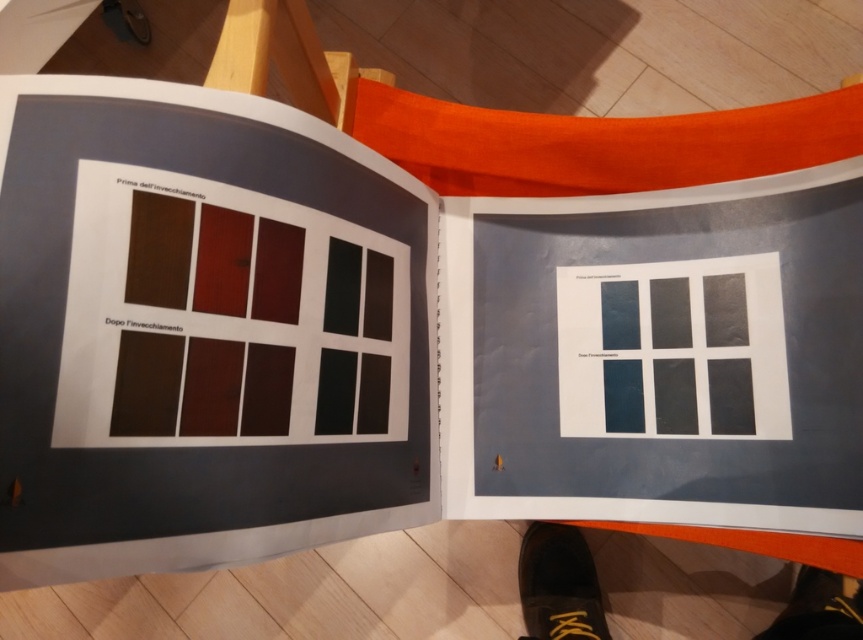
You are holding a measuring tool and need to determine if a specific point in the image is within a safe distance for a robotic arm to reach. The robotic arm has a maximum reach of 36 inches. Is the point at coordinates point (x=861, y=593) within the robotic arm reach?

The distance of point (x=861, y=593) from camera is 35.03 inches, so yes, the robotic arm can reach it since its maximum reach is 36 inches, which is longer than the distance of 35.03 inches.

Where is the black leather shoe at lower right located in the image?

The black leather shoe at lower right is located at point (x=559, y=584) in the image.